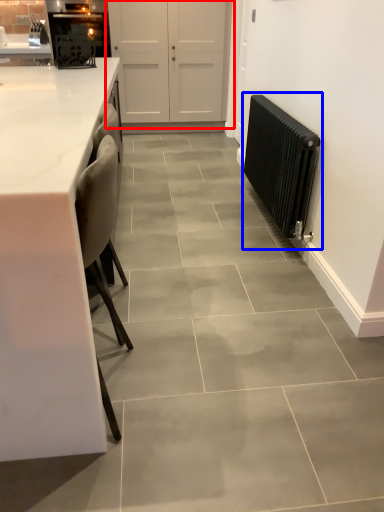
Question: Which of the following is the closest to the observer, door (highlighted by a red box) or radiator (highlighted by a blue box)?

Choices:
 (A) door
 (B) radiator

Answer: (B)